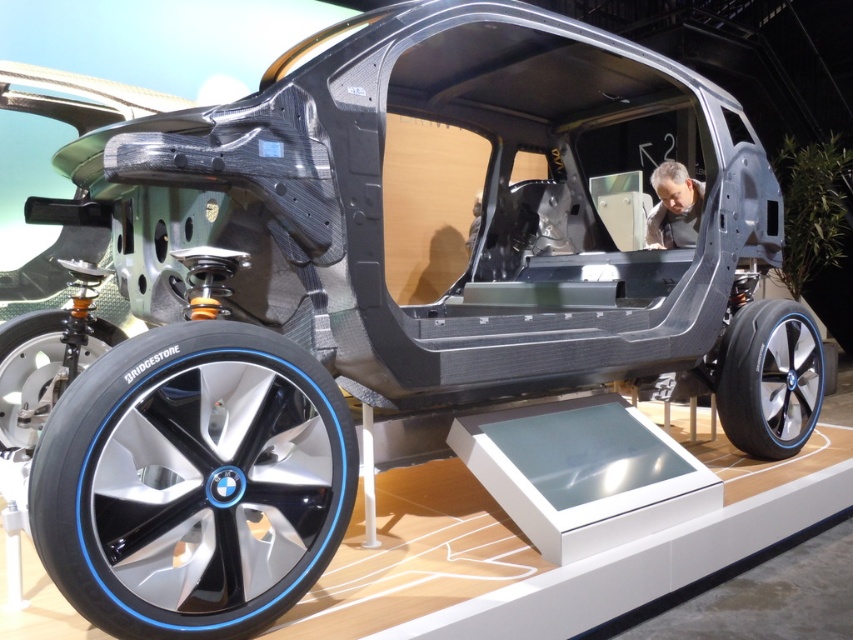
Is point (747, 369) less distant than point (16, 412)?

That is False.

Can you confirm if shiny metallic wheel at lower right is positioned below shiny silver rim at lower left?

Yes.

This screenshot has height=640, width=853. I want to click on shiny metallic wheel at lower right, so click(769, 378).

Is shiny metallic wheel at lower right wider than gray matte skin at center?

Correct, the width of shiny metallic wheel at lower right exceeds that of gray matte skin at center.

Does point (720, 362) lie behind point (688, 218)?

No, it is not.

This screenshot has height=640, width=853. In order to click on shiny metallic wheel at lower right in this screenshot , I will do `click(769, 378)`.

The image size is (853, 640). What do you see at coordinates (193, 483) in the screenshot?
I see `polished aluminum wheel at lower left` at bounding box center [193, 483].

Is point (170, 616) in front of point (42, 365)?

Yes, it is in front of point (42, 365).

The width and height of the screenshot is (853, 640). Find the location of `polished aluminum wheel at lower left`. polished aluminum wheel at lower left is located at coordinates (193, 483).

Where is `polished aluminum wheel at lower left`? polished aluminum wheel at lower left is located at coordinates (193, 483).